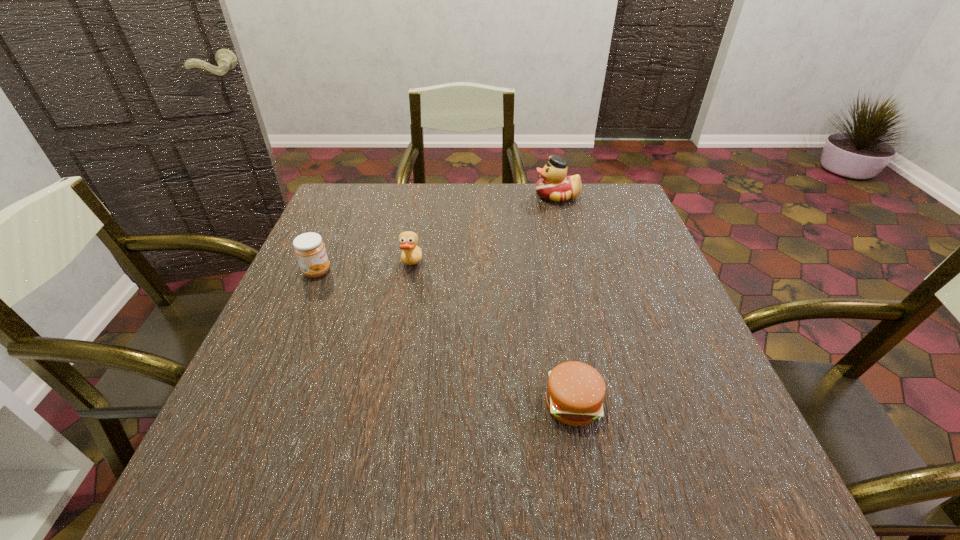
Locate an element on the screen. This screenshot has width=960, height=540. free space located on the beak of the nearer duck is located at coordinates (570, 266).

The image size is (960, 540). I want to click on free location located on the front label of the jam, so click(x=419, y=272).

This screenshot has height=540, width=960. In order to click on blank area located on the back of the hamburger in this screenshot , I will do `click(558, 326)`.

The image size is (960, 540). Identify the location of object present at the far edge. (554, 185).

At what (x,y) coordinates should I click in order to perform the action: click on object positioned at the left edge. Please return your answer as a coordinate pair (x, y). This screenshot has height=540, width=960. Looking at the image, I should click on (309, 248).

Where is `object that is positioned at the right edge`? The height and width of the screenshot is (540, 960). object that is positioned at the right edge is located at coordinates (554, 185).

Where is `object located in the far right corner section of the desktop`? This screenshot has height=540, width=960. object located in the far right corner section of the desktop is located at coordinates (554, 185).

Locate an element on the screen. free space at the far edge of the desktop is located at coordinates (523, 194).

I want to click on free space at the near edge, so [467, 470].

Find the location of a particular element. The image size is (960, 540). vacant region at the left edge is located at coordinates (281, 362).